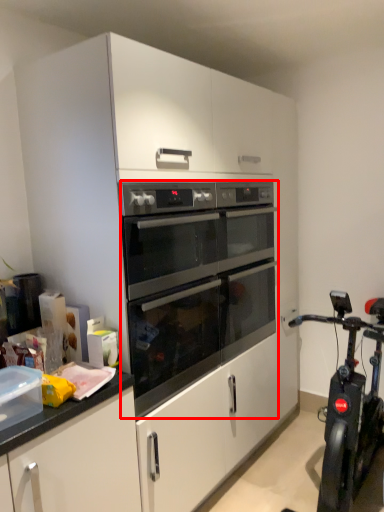
Question: In this image, where is oven (annotated by the red box) located relative to stationary bicycle?

Choices:
 (A) right
 (B) left

Answer: (B)